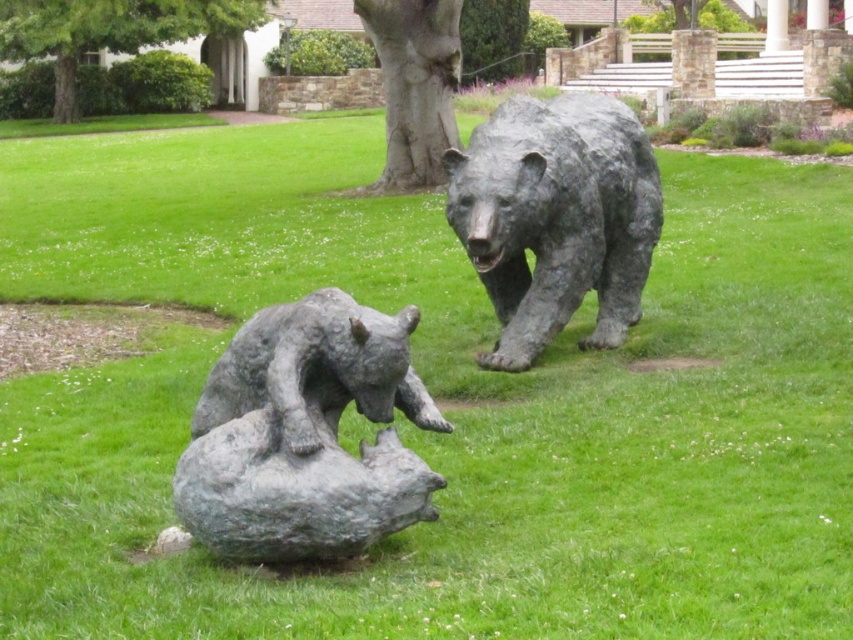
Question: Can you confirm if bronze bear at center is thinner than green leafy tree at upper center?

Choices:
 (A) yes
 (B) no

Answer: (B)

Question: Among these objects, which one is farthest from the camera?

Choices:
 (A) rough gray bear at center
 (B) green leafy tree at upper center
 (C) bronze bear at center

Answer: (B)

Question: Is smooth gray tree trunk at center positioned at the back of green leafy tree at upper center?

Choices:
 (A) no
 (B) yes

Answer: (A)

Question: Can you confirm if rough gray bear at center is wider than green leafy tree at upper center?

Choices:
 (A) no
 (B) yes

Answer: (B)

Question: Which point is farther to the camera?

Choices:
 (A) smooth gray tree trunk at center
 (B) green leafy tree at upper center

Answer: (B)

Question: Considering the real-world distances, which object is farthest from the rough gray bear at center?

Choices:
 (A) green leafy tree at upper center
 (B) bronze bear at center

Answer: (A)